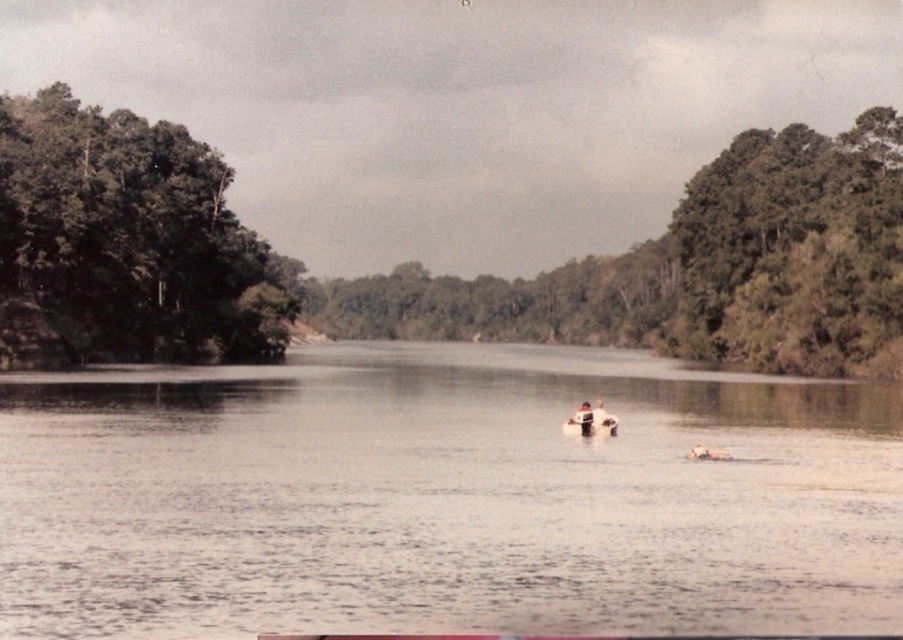
Question: Which of the following is the farthest from the observer?

Choices:
 (A) smooth white surfboard at center
 (B) clear water at center

Answer: (A)

Question: Is clear water at center to the right of green leafy trees at left from the viewer's perspective?

Choices:
 (A) yes
 (B) no

Answer: (A)

Question: Can you confirm if green leafy trees at center is positioned to the right of wooden boat at center?

Choices:
 (A) yes
 (B) no

Answer: (A)

Question: Is green leafy tree at right smaller than smooth white surfboard at center?

Choices:
 (A) no
 (B) yes

Answer: (A)

Question: Which point is farther to the camera?

Choices:
 (A) green leafy trees at left
 (B) white plastic person at center
 (C) green leafy trees at center
 (D) green leafy tree at right

Answer: (C)

Question: Which point appears closest to the camera in this image?

Choices:
 (A) pyautogui.click(x=590, y=435)
 (B) pyautogui.click(x=225, y=397)

Answer: (A)